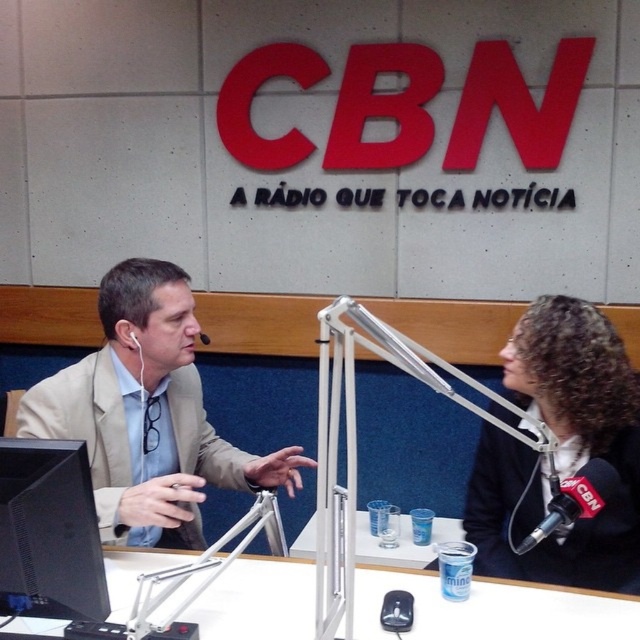
In the scene shown: You are a guest on a radio show and need to sit next to the host wearing a curly hair black blazer at right. Where should you sit relative to the white plastic table at center?

You should sit on the right side of the white plastic table at center next to the curly hair black blazer at right since the curly hair black blazer at right is positioned on the right side of the white plastic table at center.

Based on the coordinates provided, which object is located at point (148, 413) in the image?

The point (148, 413) corresponds to the beige fabric suit at left.

You are a sound technician in the studio and need to adjust the white earphone at left. Where should you look to find the beige fabric suit at left?

The beige fabric suit at left is located below the white earphone at left, so you should look downward from the white earphone at left to find it.